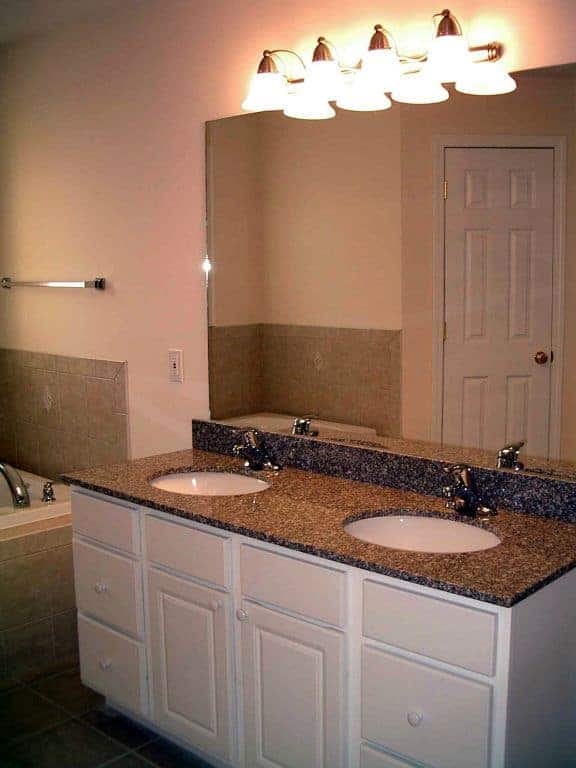
Locate an element on the screen. faucet is located at coordinates (463, 495).